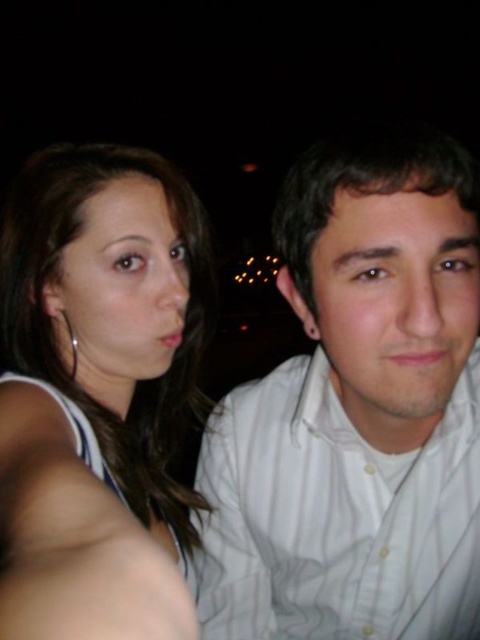
You are a photographer trying to capture the best angle for a group photo. You notice the white striped shirt at center and the matte white tank top at left. Which clothing item should you focus on first if you want to ensure both subjects are evenly lit, considering their positions?

The white striped shirt at center is positioned on the right side of matte white tank top at left. Since the flash is likely coming from the camera on the left, the matte white tank top at left might be in shadow, so focus on the white striped shirt at center first to balance the lighting.

You are a photographer trying to capture a clear selfie of the two subjects in the dark. The camera has a minimum focus distance of 12 inches. Based on the scene, will the camera be able to focus on both the white striped shirt at center and the white smooth skin at center?

The white striped shirt at center and white smooth skin at center are 13.00 inches apart, which is beyond the camera minimum focus distance of 12 inches. Therefore, the camera can focus on both subjects.